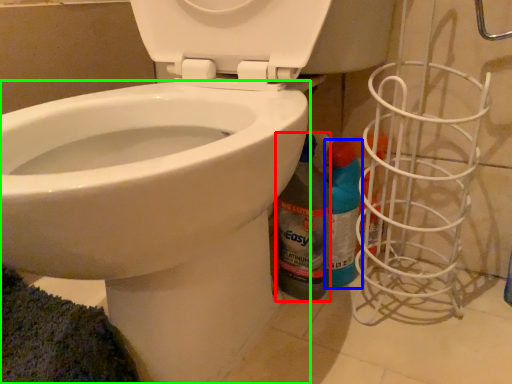
Question: Estimate the real-world distances between objects in this image. Which object is farther from cleaning product (highlighted by a red box), cleaning product (highlighted by a blue box) or bidet (highlighted by a green box)?

Choices:
 (A) cleaning product
 (B) bidet

Answer: (B)